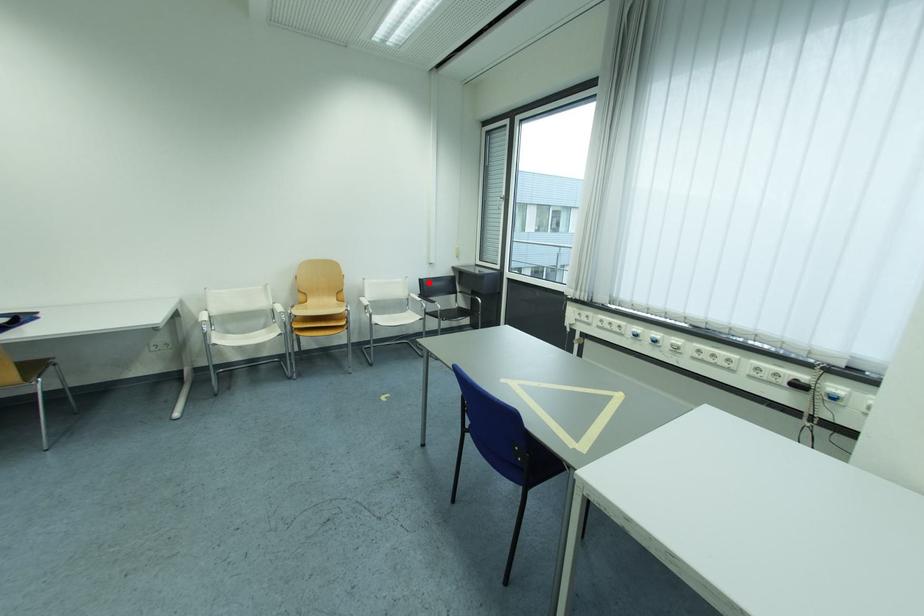
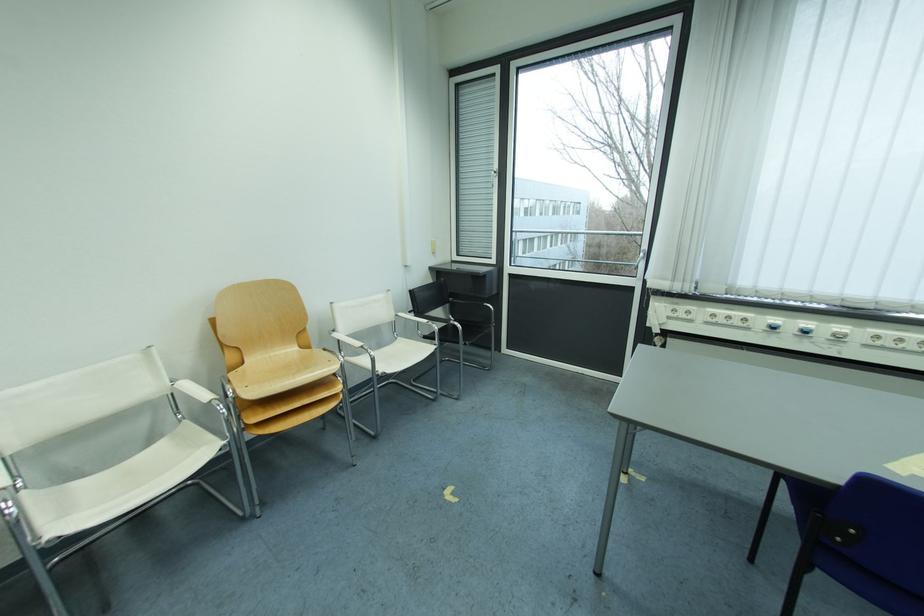
Question: I am providing you with two images of the same scene from different viewpoints. In image1, a red point is highlighted. Considering the same 3D point in image2, which of the following is correct?

Choices:
 (A) It is closer
 (B) It is farther

Answer: (B)